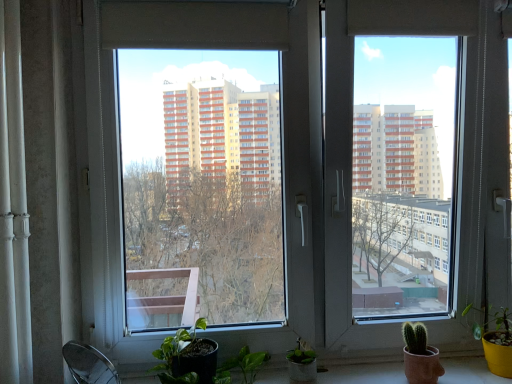
Question: From the image's perspective, relative to white glossy curtain at left, is transparent glass window at center above or below?

Choices:
 (A) above
 (B) below

Answer: (A)

Question: From a real-world perspective, is transparent glass window at center positioned above or below white glossy curtain at left?

Choices:
 (A) below
 (B) above

Answer: (B)

Question: Which object is the closest to the white glossy window sill at lower center?

Choices:
 (A) transparent glass window at center
 (B) white glossy curtain at left
 (C) matte yellow pot at lower right

Answer: (C)

Question: Which object is positioned farthest from the white glossy window sill at lower center?

Choices:
 (A) matte yellow pot at lower right
 (B) transparent glass window at center
 (C) white glossy curtain at left

Answer: (C)